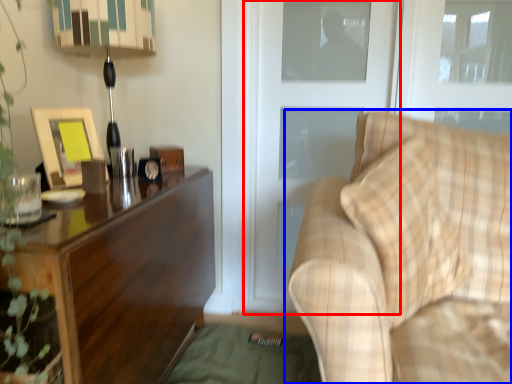
Question: Which object appears closest to the camera in this image, screen door (highlighted by a red box) or studio couch (highlighted by a blue box)?

Choices:
 (A) screen door
 (B) studio couch

Answer: (B)